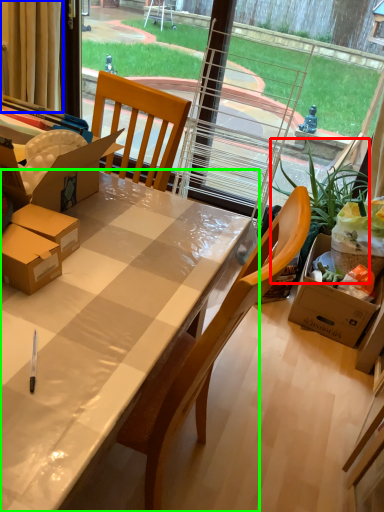
Question: Which is farther away from houseplant (highlighted by a red box)? curtain (highlighted by a blue box) or desk (highlighted by a green box)?

Choices:
 (A) curtain
 (B) desk

Answer: (A)